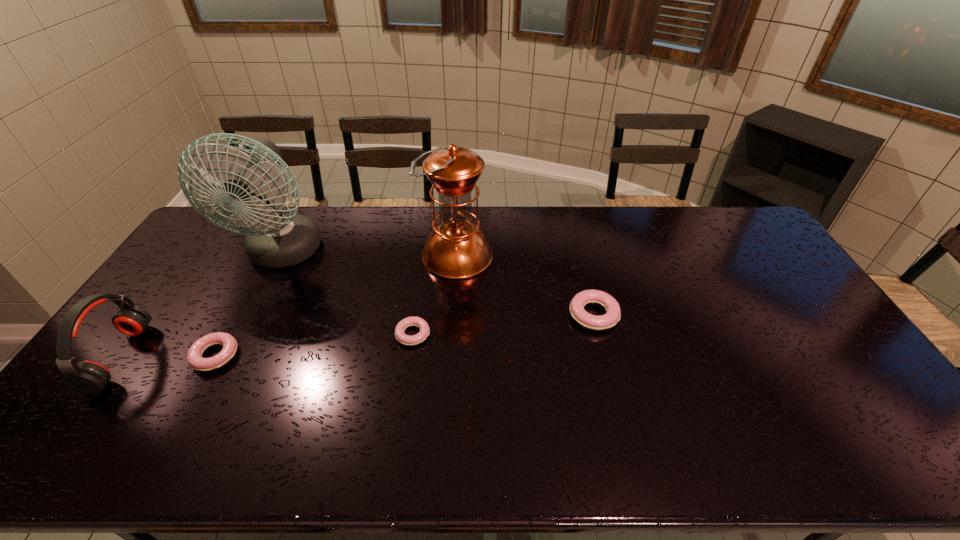
This screenshot has height=540, width=960. Identify the location of the fifth tallest object. (194, 356).

You are a GUI agent. You are given a task and a screenshot of the screen. Output one action in this format:
    pyautogui.click(x=<x>, y=<y>)
    Task: Click on the second shortest doughnut
    The height and width of the screenshot is (540, 960).
    Given the screenshot: What is the action you would take?
    pyautogui.click(x=194, y=356)

Locate an element on the screen. This screenshot has width=960, height=540. the shortest object is located at coordinates (408, 340).

Where is `the second doughnut from right to left`? the second doughnut from right to left is located at coordinates (408, 340).

Find the location of a particular element. The height and width of the screenshot is (540, 960). the tallest doughnut is located at coordinates (613, 313).

At what (x,y) coordinates should I click in order to perform the action: click on the rightmost doughnut. Please return your answer as a coordinate pair (x, y). Looking at the image, I should click on (613, 313).

Locate an element on the screen. fan is located at coordinates tap(276, 239).

This screenshot has width=960, height=540. Identify the location of earphone. (88, 377).

You are a GUI agent. You are given a task and a screenshot of the screen. Output one action in this format:
    pyautogui.click(x=<x>, y=<y>)
    Task: Click on the third tallest object
    This screenshot has height=540, width=960.
    Given the screenshot: What is the action you would take?
    pyautogui.click(x=88, y=377)

Identify the location of oil lamp. (456, 249).